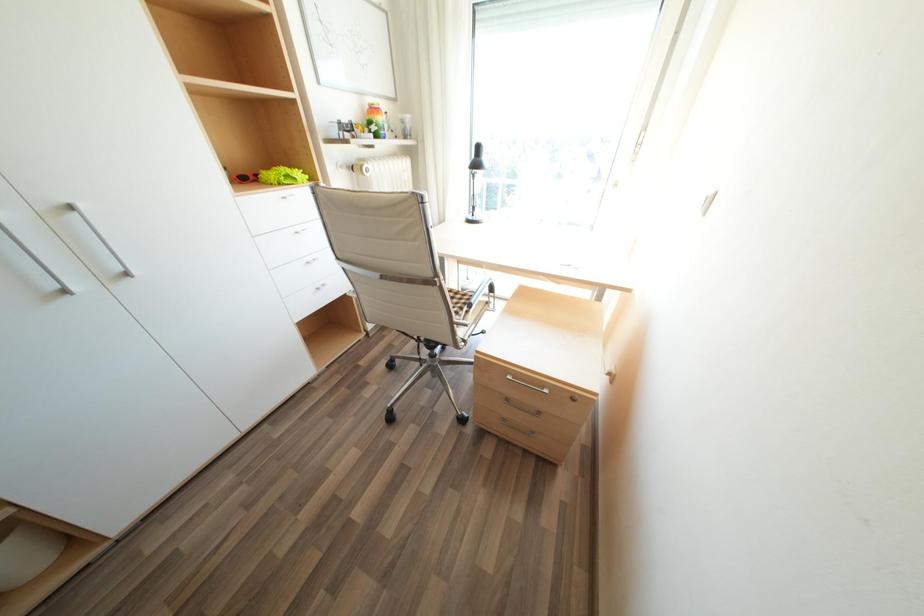
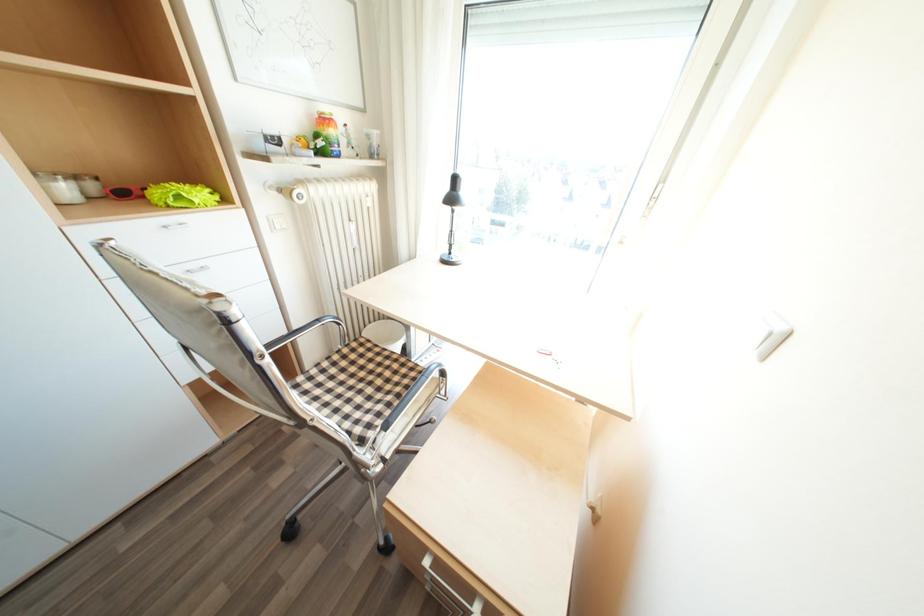
Which direction would the cameraman need to move to produce the second image?

The movement direction of the cameraman is right, forward.